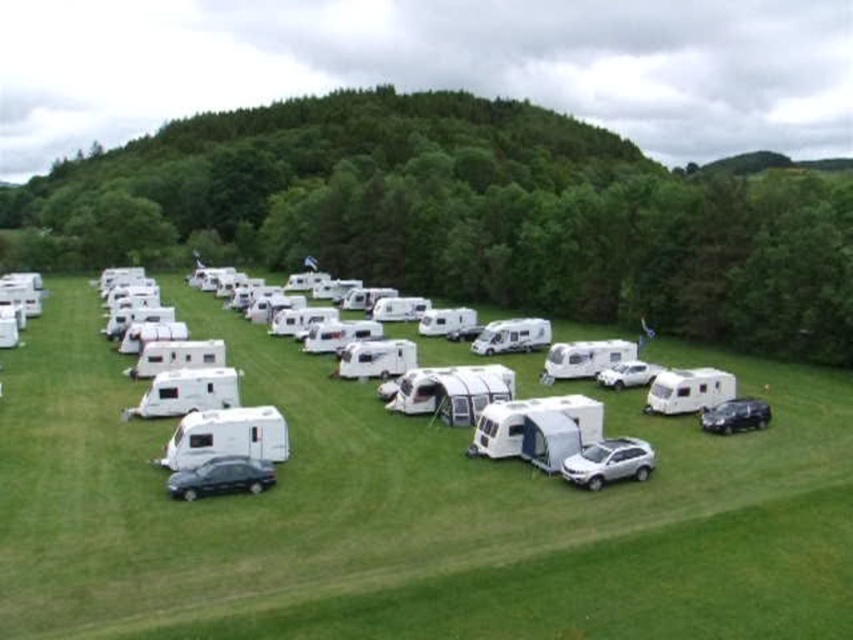
Is satin black car at lower right closer to camera compared to white matte car at center?

Yes, satin black car at lower right is in front of white matte car at center.

Which is more to the left, satin black car at lower right or white matte car at center?

white matte car at center

Locate an element on the screen. This screenshot has height=640, width=853. satin black car at lower right is located at coordinates (735, 416).

Between satin silver suv at center and shiny dark gray car at lower left, which one appears on the right side from the viewer's perspective?

Positioned to the right is satin silver suv at center.

Who is taller, satin silver suv at center or shiny dark gray car at lower left?

shiny dark gray car at lower left

Image resolution: width=853 pixels, height=640 pixels. Describe the element at coordinates (608, 461) in the screenshot. I see `satin silver suv at center` at that location.

The width and height of the screenshot is (853, 640). I want to click on satin silver suv at center, so click(x=608, y=461).

Does green grassy field at center have a lesser height compared to satin black car at lower right?

No.

Is green grassy field at center bigger than satin black car at lower right?

Yes.

Is point (368, 548) farther from viewer compared to point (758, 422)?

No, it is in front of (758, 422).

I want to click on green grassy field at center, so click(407, 513).